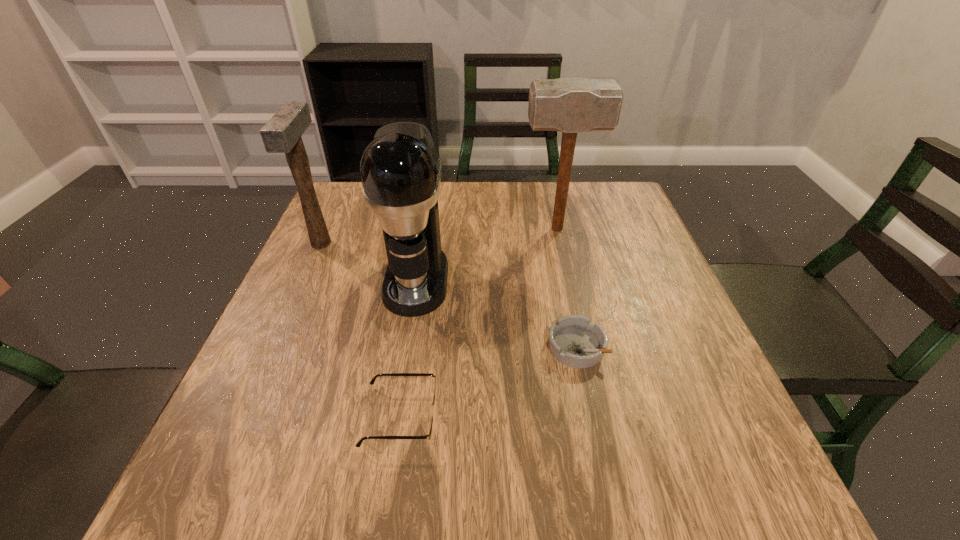
Locate an element on the screen. vacant area between the right mallet and the nearest object is located at coordinates (479, 322).

Locate an element on the screen. This screenshot has width=960, height=540. vacant area between the right mallet and the ashtray is located at coordinates (566, 288).

Identify which object is located as the fourth nearest to the coffee maker. Please provide its 2D coordinates. Your answer should be formatted as a tuple, i.e. [(x, y)], where the tuple contains the x and y coordinates of a point satisfying the conditions above.

[(575, 342)]

Image resolution: width=960 pixels, height=540 pixels. In order to click on object that ranks as the closest to the second nearest object in this screenshot , I will do `click(433, 404)`.

Locate an element on the screen. The image size is (960, 540). vacant point that satisfies the following two spatial constraints: 1. on the striking face of the right mallet; 2. place cup under the spout of the coffee maker is located at coordinates (569, 280).

Where is `vacant area that satisfies the following two spatial constraints: 1. on the front side of the ashtray; 2. at the hinge ends of the nearest object`? The height and width of the screenshot is (540, 960). vacant area that satisfies the following two spatial constraints: 1. on the front side of the ashtray; 2. at the hinge ends of the nearest object is located at coordinates (591, 416).